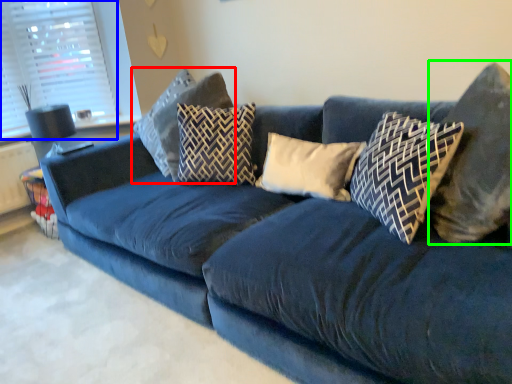
Question: Which object is the closest to the pillow (highlighted by a red box)? Choose among these: window screen (highlighted by a blue box) or pillow (highlighted by a green box).

Choices:
 (A) window screen
 (B) pillow

Answer: (A)